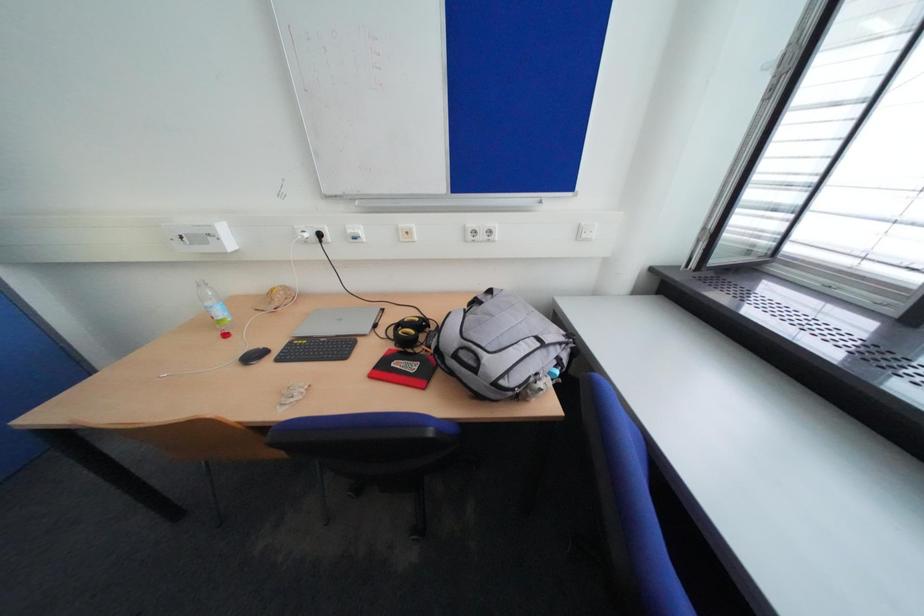
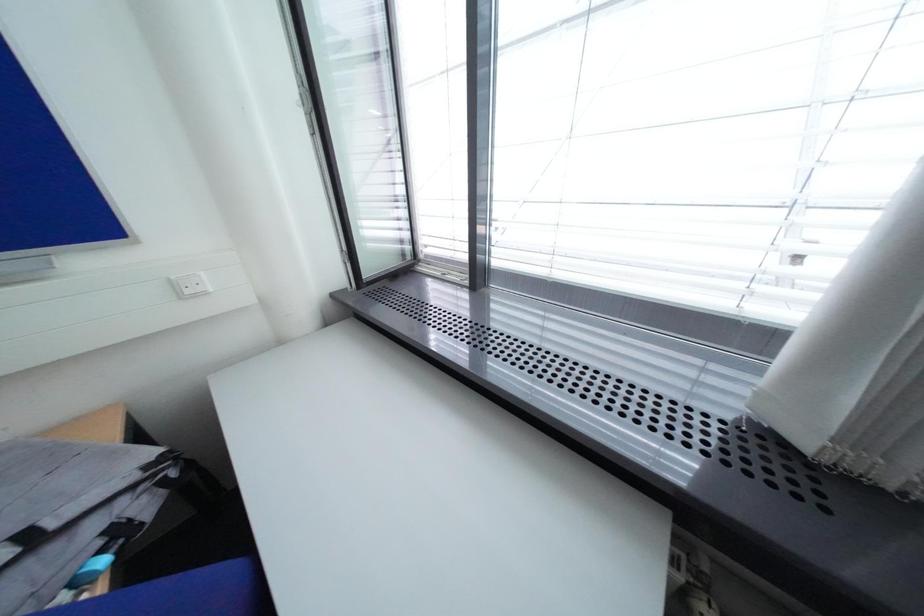
Question: The camera is either moving clockwise (left) or counter-clockwise (right) around the object. The first image is from the beginning of the video and the second image is from the end. Is the camera moving left or right when shooting the video?

Choices:
 (A) Left
 (B) Right

Answer: (A)